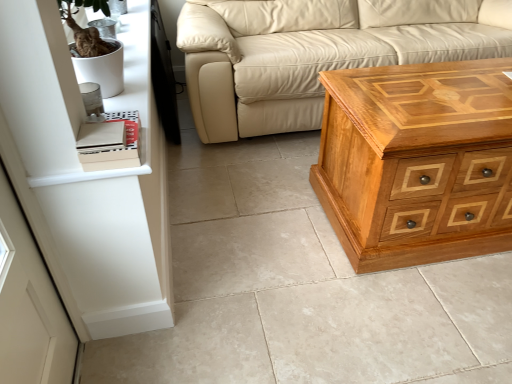
Question: Is white matte shelf at upper left surrounding polished wood chest of drawers at right?

Choices:
 (A) no
 (B) yes

Answer: (A)

Question: From the image's perspective, is white matte shelf at upper left under polished wood chest of drawers at right?

Choices:
 (A) no
 (B) yes

Answer: (A)

Question: Does white matte shelf at upper left appear on the right side of polished wood chest of drawers at right?

Choices:
 (A) no
 (B) yes

Answer: (A)

Question: Is white matte shelf at upper left closer to camera compared to polished wood chest of drawers at right?

Choices:
 (A) yes
 (B) no

Answer: (A)

Question: Is white matte shelf at upper left to the left of polished wood chest of drawers at right from the viewer's perspective?

Choices:
 (A) no
 (B) yes

Answer: (B)

Question: Can we say white matte shelf at upper left lies outside polished wood chest of drawers at right?

Choices:
 (A) no
 (B) yes

Answer: (B)

Question: Is polished wood chest of drawers at right next to white matte shelf at upper left?

Choices:
 (A) no
 (B) yes

Answer: (A)

Question: Is polished wood chest of drawers at right to the right of white matte shelf at upper left from the viewer's perspective?

Choices:
 (A) yes
 (B) no

Answer: (A)

Question: Does polished wood chest of drawers at right have a lesser width compared to white matte shelf at upper left?

Choices:
 (A) no
 (B) yes

Answer: (A)

Question: Considering the relative sizes of polished wood chest of drawers at right and white matte shelf at upper left in the image provided, is polished wood chest of drawers at right wider than white matte shelf at upper left?

Choices:
 (A) yes
 (B) no

Answer: (A)

Question: Is polished wood chest of drawers at right to the left of white matte shelf at upper left from the viewer's perspective?

Choices:
 (A) yes
 (B) no

Answer: (B)

Question: Could you tell me if polished wood chest of drawers at right is turned towards white matte shelf at upper left?

Choices:
 (A) no
 (B) yes

Answer: (A)

Question: From the image's perspective, does polished wood chest of drawers at right appear lower than beige leather couch at center?

Choices:
 (A) no
 (B) yes

Answer: (B)